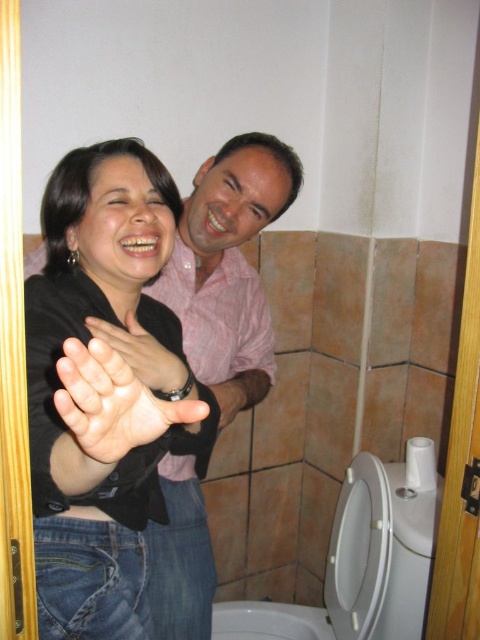
You are a photographer trying to capture a candid shot of the black matte shirt at center and the white glossy toilet bowl at lower right in the bathroom scene. Since you want both subjects to be clearly visible, does the height difference between them pose a problem for your camera angle?

The black matte shirt at center is much taller than the white glossy toilet bowl at lower right, so adjusting the camera angle to focus on the black matte shirt at center while still capturing the white glossy toilet bowl at lower right in the frame would be necessary to ensure both are visible.

You are standing in the bathroom and want to move from the point at coordinates point (163, 308) to the point at coordinates point (225, 620). Is the destination point behind or in front of your starting position?

Point (163, 308) is in front of point (225, 620), so the destination point is behind your starting position.

You are a photographer trying to capture a candid shot of the two people in the bathroom. You notice the white glossy toilet bowl at lower right and the matte black hand at center. Which object is closer to your camera lens?

The white glossy toilet bowl at lower right is closer to the camera lens because it is further to the viewer than the matte black hand at center.